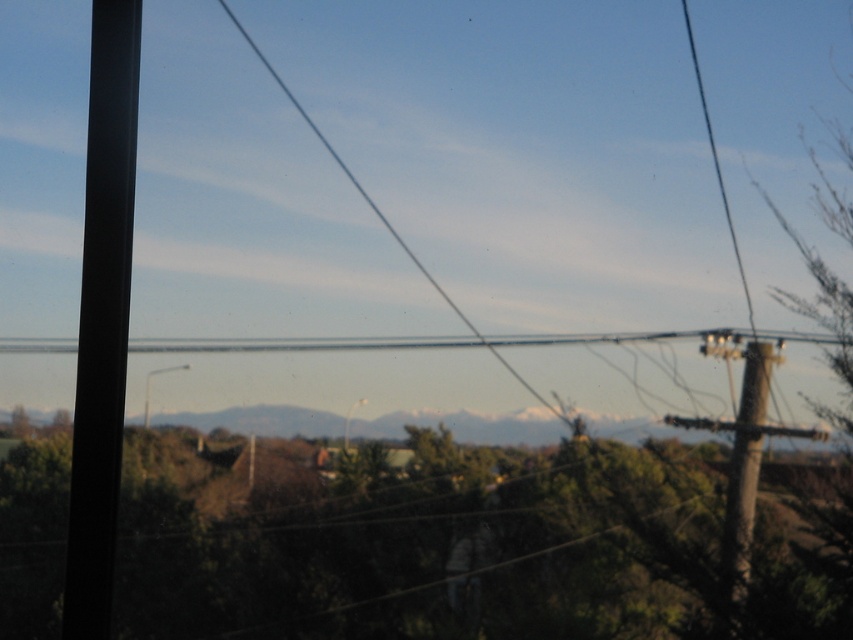
Question: Does green leafy tree at center have a greater width compared to brown rough wood telegraph pole at right?

Choices:
 (A) yes
 (B) no

Answer: (A)

Question: Can you confirm if green leafy tree at center is positioned to the left of brown rough wood telegraph pole at right?

Choices:
 (A) yes
 (B) no

Answer: (A)

Question: Where is green leafy tree at center located in relation to brown rough wood telegraph pole at right in the image?

Choices:
 (A) left
 (B) right

Answer: (A)